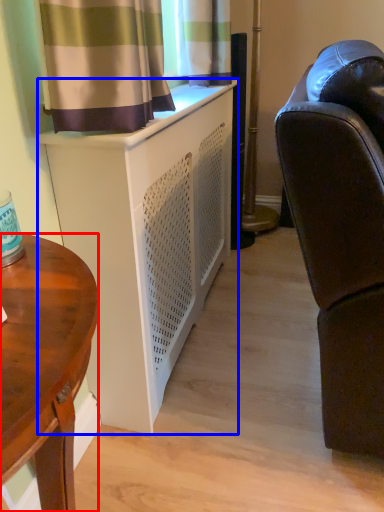
Question: Which point is further to the camera, desk (highlighted by a red box) or cabinetry (highlighted by a blue box)?

Choices:
 (A) desk
 (B) cabinetry

Answer: (B)